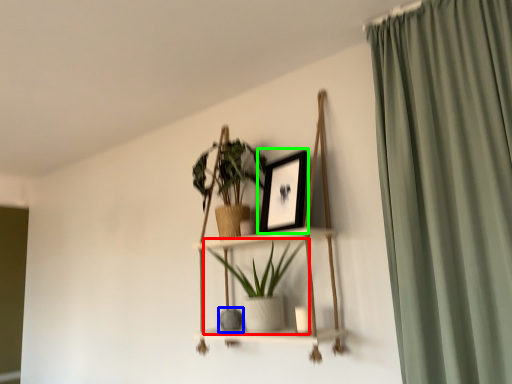
Question: Based on their relative distances, which object is nearer to houseplant (highlighted by a red box)? Choose from vase (highlighted by a blue box) and picture frame (highlighted by a green box).

Choices:
 (A) vase
 (B) picture frame

Answer: (A)